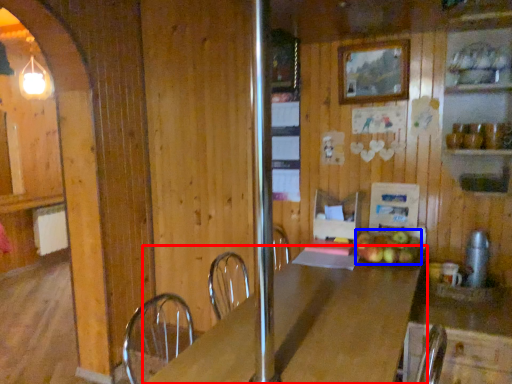
Question: Which point is further to the camera, table (highlighted by a red box) or apple (highlighted by a blue box)?

Choices:
 (A) table
 (B) apple

Answer: (B)